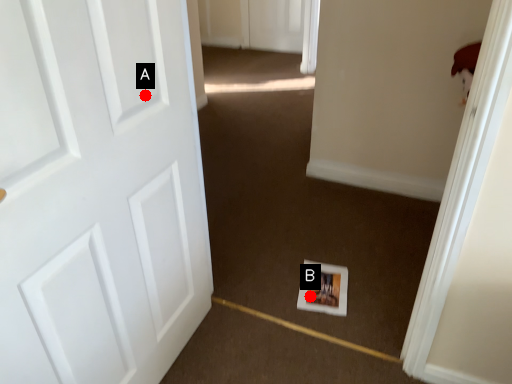
Question: Two points are circled on the image, labeled by A and B beside each circle. Among these points, which one is farthest from the camera?

Choices:
 (A) A is further
 (B) B is further

Answer: (B)